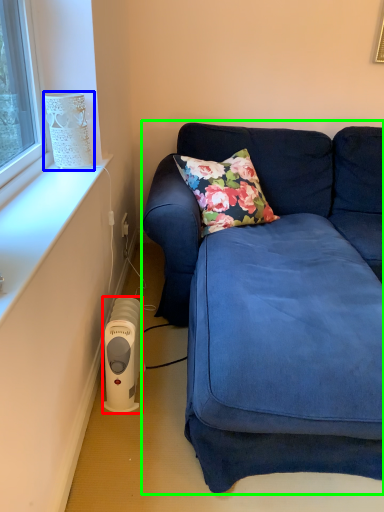
Question: Estimate the real-world distances between objects in this image. Which object is closer to appliance (highlighted by a red box), lamp (highlighted by a blue box) or studio couch (highlighted by a green box)?

Choices:
 (A) lamp
 (B) studio couch

Answer: (B)